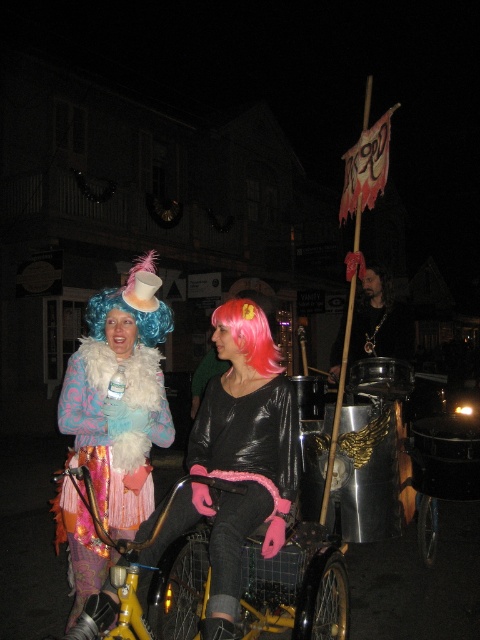
Question: Which point appears closest to the camera in this image?

Choices:
 (A) (85, 312)
 (B) (200, 522)
 (C) (228, 321)

Answer: (C)

Question: Can you confirm if pinkhair at center is positioned above blue curly wig at upper left?

Choices:
 (A) no
 (B) yes

Answer: (A)

Question: Is shiny black shirt at center thinner than black matte hair at upper right?

Choices:
 (A) no
 (B) yes

Answer: (A)

Question: Among these points, which one is farthest from the camera?

Choices:
 (A) (212, 323)
 (B) (160, 566)
 (C) (79, 436)
 (D) (370, 298)

Answer: (A)

Question: Which object is positioned farthest from the pinkhair at center?

Choices:
 (A) shiny black shirt at center
 (B) glossy black jacket at center

Answer: (A)

Question: Considering the relative positions of glossy black jacket at center and blue curly wig at upper left in the image provided, where is glossy black jacket at center located with respect to blue curly wig at upper left?

Choices:
 (A) above
 (B) below

Answer: (B)